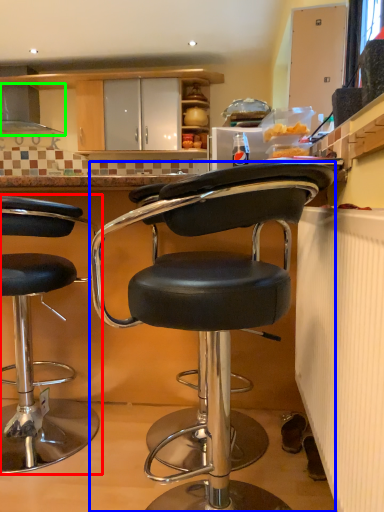
Question: Which is farther away from chair (highlighted by a red box)? chair (highlighted by a blue box) or exhaust hood (highlighted by a green box)?

Choices:
 (A) chair
 (B) exhaust hood

Answer: (B)